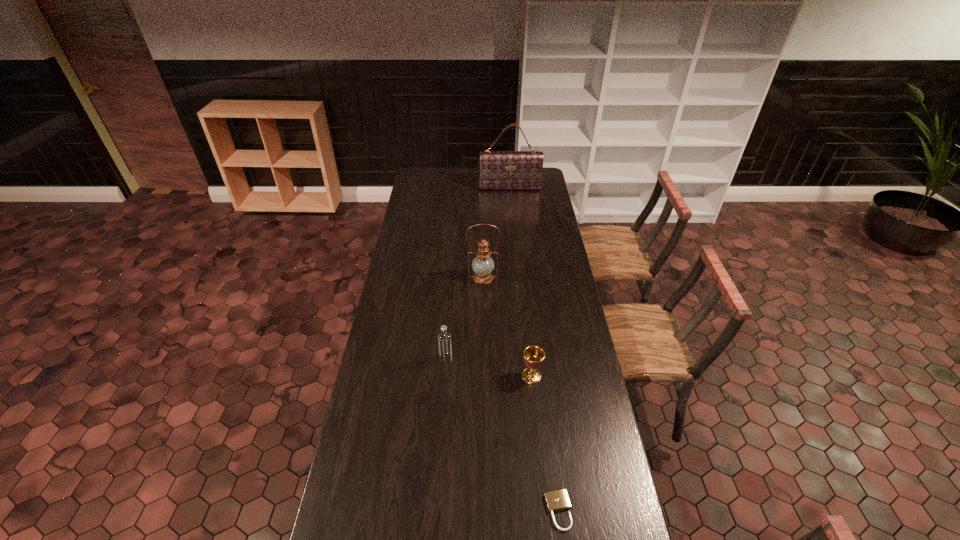
This screenshot has height=540, width=960. In order to click on vacant space that satisfies the following two spatial constraints: 1. on the front of the chalice with the clasp; 2. on the left side of the farthest object in this screenshot , I will do `click(528, 376)`.

The image size is (960, 540). I want to click on free space that satisfies the following two spatial constraints: 1. on the back side of the shortest object; 2. on the front label of the vodka, so click(x=540, y=359).

You are a GUI agent. You are given a task and a screenshot of the screen. Output one action in this format:
    pyautogui.click(x=<x>, y=<y>)
    Task: Click on the free space that satisfies the following two spatial constraints: 1. on the front of the nearest object with the clasp; 2. on the left side of the handbag
    This screenshot has height=540, width=960.
    Given the screenshot: What is the action you would take?
    pyautogui.click(x=541, y=511)

Find the location of `vacant region that satisfies the following two spatial constraints: 1. on the front of the handbag with the clasp; 2. on the right side of the padlock`. vacant region that satisfies the following two spatial constraints: 1. on the front of the handbag with the clasp; 2. on the right side of the padlock is located at coordinates (541, 511).